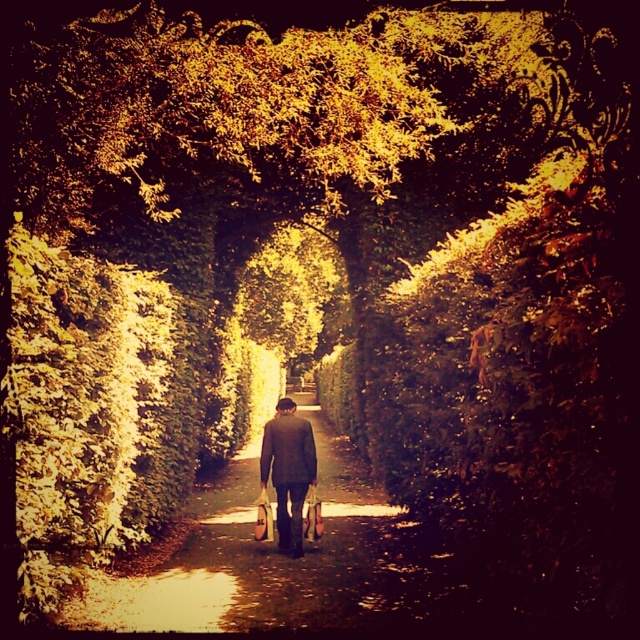
Who is positioned more to the left, brown textured path at center or dark brown suit at center?

brown textured path at center

The image size is (640, 640). What are the coordinates of `brown textured path at center` in the screenshot? It's located at (280, 563).

The width and height of the screenshot is (640, 640). Describe the element at coordinates (280, 563) in the screenshot. I see `brown textured path at center` at that location.

Locate an element on the screen. This screenshot has height=640, width=640. brown textured path at center is located at coordinates (280, 563).